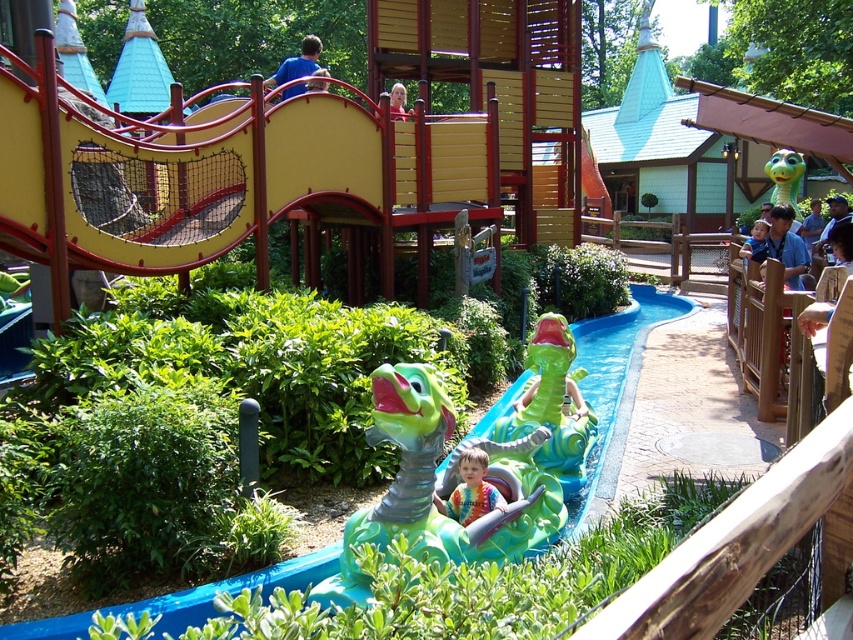
Question: Which of the following is the farthest from the observer?

Choices:
 (A) (393, 112)
 (B) (309, 74)
 (C) (795, 234)

Answer: (C)

Question: Is green rubber dinosaur at upper right wider than blonde hair at upper center?

Choices:
 (A) no
 (B) yes

Answer: (A)

Question: Does green rubber dinosaur at upper right appear on the left side of blonde hair at upper center?

Choices:
 (A) yes
 (B) no

Answer: (B)

Question: Which is farther from the blue denim shirt at upper right?

Choices:
 (A) blue matte shirt at upper center
 (B) green rubber dinosaur at upper right
 (C) green rubber crocodile at center

Answer: (B)

Question: Estimate the real-world distances between objects in this image. Which object is farther from the blonde hair at upper center?

Choices:
 (A) tie-dye fabric at center
 (B) green rubber dinosaur at upper right
 (C) green rubber crocodile at center

Answer: (B)

Question: Can you confirm if tie-dye fabric at center is positioned to the right of green rubber dinosaur at upper right?

Choices:
 (A) no
 (B) yes

Answer: (A)